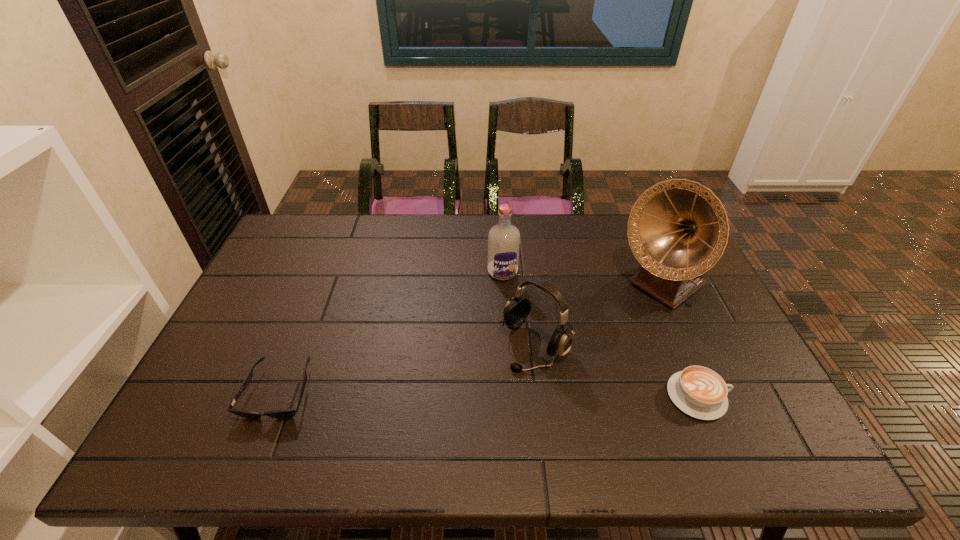
You are a GUI agent. You are given a task and a screenshot of the screen. Output one action in this format:
    pyautogui.click(x=<x>, y=<y>)
    Task: Click on the leftmost object
    
    Given the screenshot: What is the action you would take?
    pyautogui.click(x=287, y=413)

Where is `cappuccino`? cappuccino is located at coordinates (698, 391).

I want to click on phonograph record, so click(x=678, y=229).

I want to click on the fourth shortest object, so (504, 238).

Where is `headset`? The image size is (960, 540). headset is located at coordinates coord(518,307).

The width and height of the screenshot is (960, 540). Find the location of `free space located on the horn of the phonograph record`. free space located on the horn of the phonograph record is located at coordinates (557, 367).

You are a GUI agent. You are given a task and a screenshot of the screen. Output one action in this format:
    pyautogui.click(x=<x>, y=<y>)
    Task: Click on the vacant region located 0.340m on the horn of the phonograph record
    
    Given the screenshot: What is the action you would take?
    pyautogui.click(x=554, y=369)

Find the location of a particular element. The image size is (960, 540). blank space located on the horn of the phonograph record is located at coordinates (554, 369).

This screenshot has height=540, width=960. Identify the location of free space located 0.190m on the label of the vodka. (516, 328).

What are the coordinates of `blank area located 0.060m on the label of the vodka` in the screenshot? It's located at (508, 296).